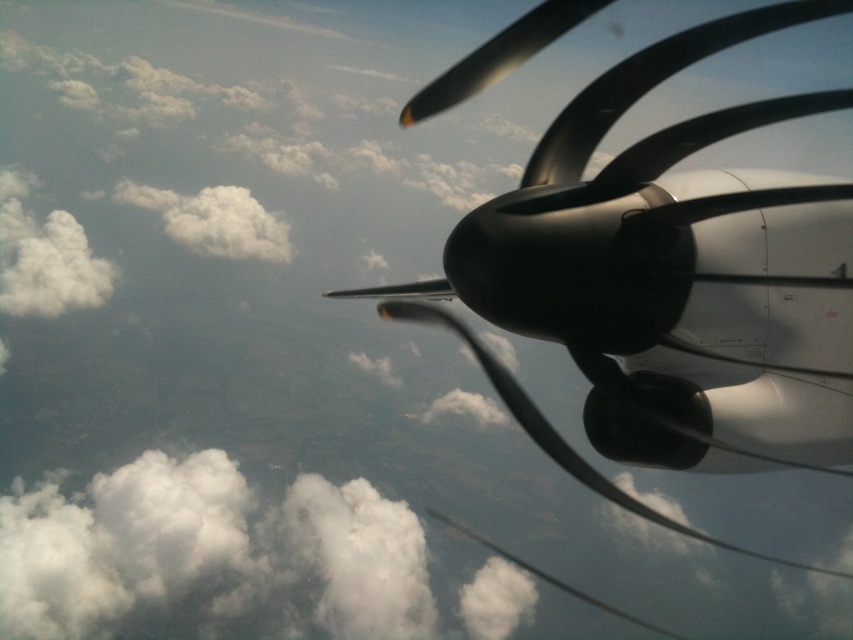
Consider the image. You are a pilot checking the weather conditions from the cockpit. You notice two clouds, the white fluffy cloud at upper left and the white fluffy cloud at upper center. Which one might indicate more severe weather based on their size?

The white fluffy cloud at upper left is bigger than the white fluffy cloud at upper center, so it might indicate more severe weather since larger clouds can be associated with stronger storm systems.

You are a passenger on an airplane and looking out the window. You see a polished metallic propeller at upper right and a white fluffy cloud at upper left. Which object is closer to the airplane?

The polished metallic propeller at upper right is closer to the airplane than the white fluffy cloud at upper left because it is positioned below it in the sky.

You are inside an aircraft and want to know how far the point at coordinates (503, 285) is from you. Can you determine the distance?

The distance of point (503, 285) from viewer is 3.32 meters.